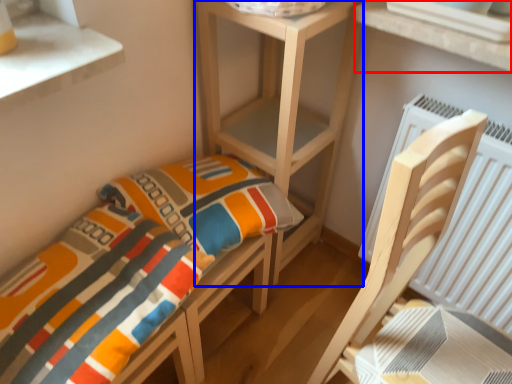
Question: Which object is further to the camera taking this photo, window (highlighted by a red box) or shelf (highlighted by a blue box)?

Choices:
 (A) window
 (B) shelf

Answer: (B)